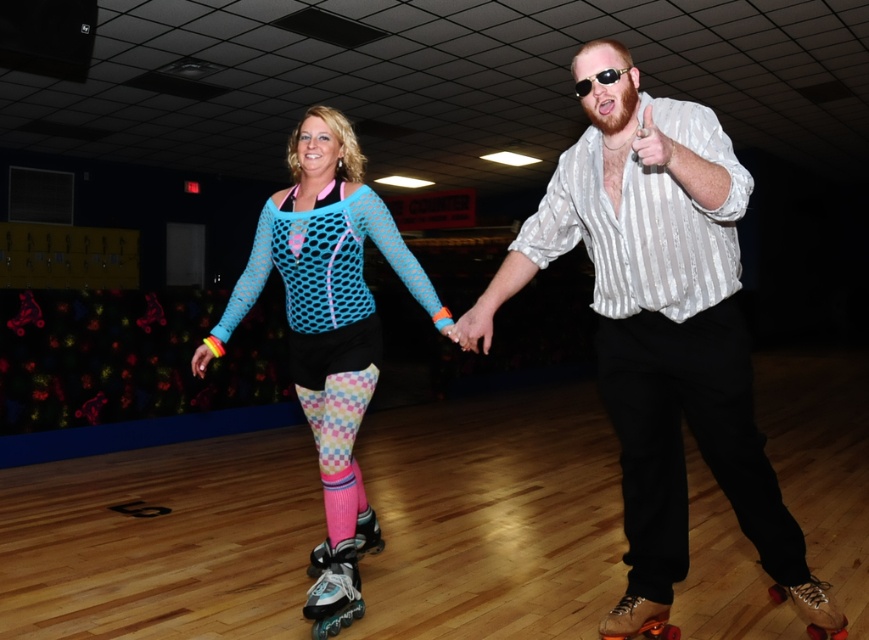
You are a skate rental attendant and need to determine which pair of roller skates is suitable for a customer who has larger feet. The customer is looking at the shiny silver roller skates at center and the shiny brown leather roller skates at lower right. Which pair should you recommend?

The shiny silver roller skates at center has a larger size compared to the shiny brown leather roller skates at lower right, so you should recommend the shiny silver roller skates at center for the customer with larger feet.

You are a photographer trying to capture a photo of both the shiny silver roller skates at center and the shiny brown leather roller skates at lower right. Which roller skates are positioned to the left of the other?

The shiny silver roller skates at center are positioned to the left of the shiny brown leather roller skates at lower right.